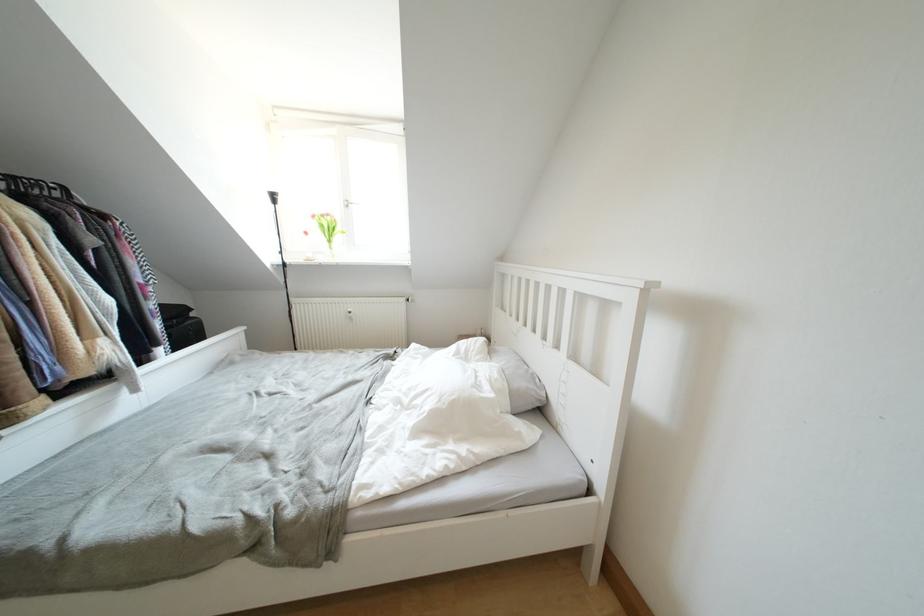
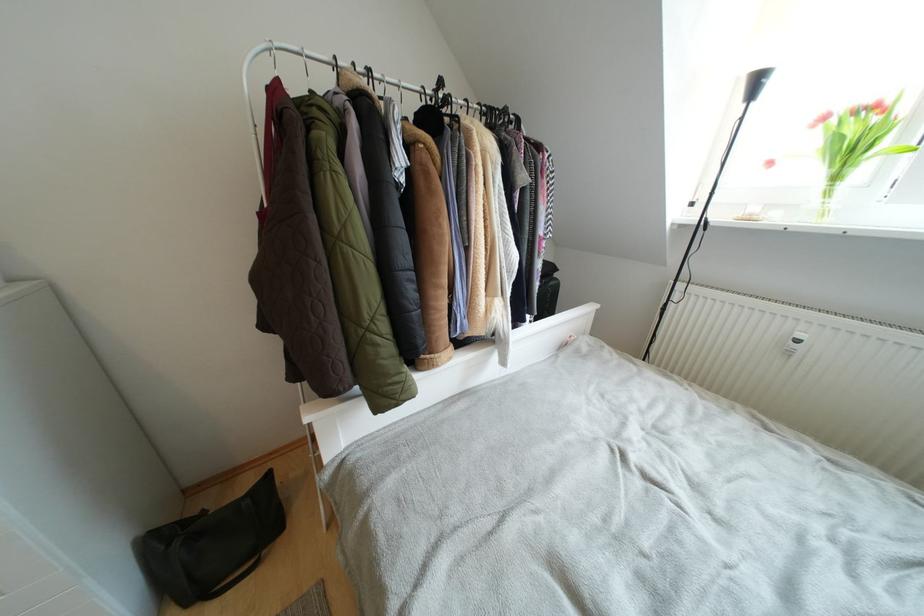
Based on the continuous images, in which direction is the camera rotating?

The rotation direction of the camera is left-down.